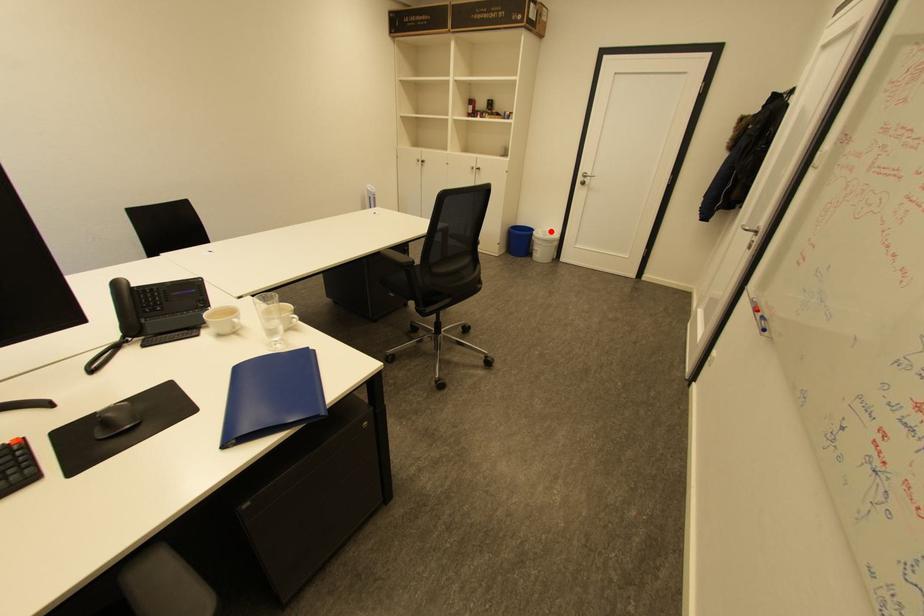
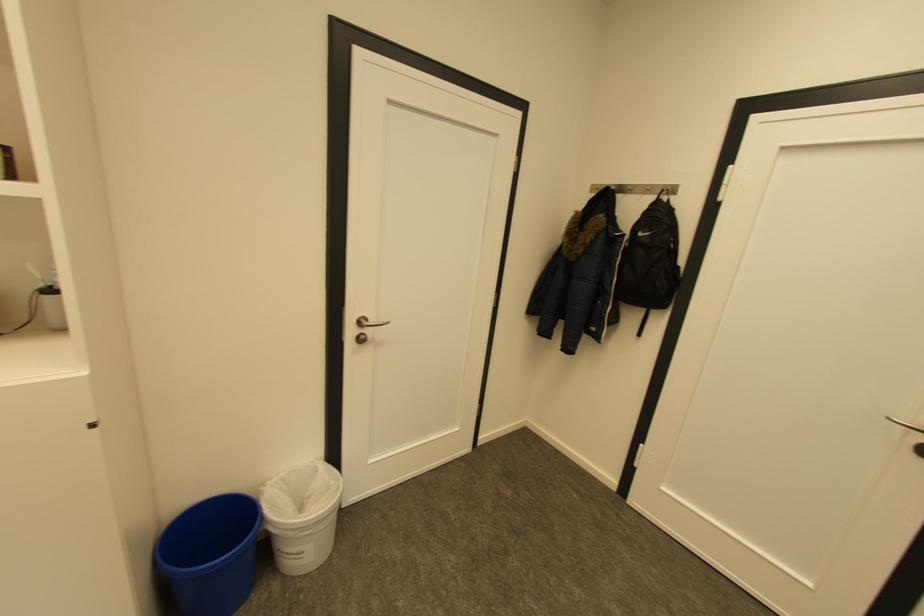
Question: I am providing you with two images of the same scene from different viewpoints. A red point is shown in image1. For the corresponding object point in image2, is it positioned nearer or farther from the camera?

Choices:
 (A) Nearer
 (B) Farther

Answer: (B)